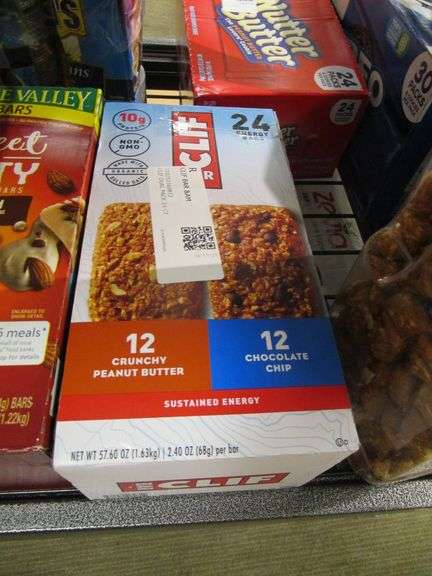
Image resolution: width=432 pixels, height=576 pixels. I want to click on jar, so pyautogui.click(x=399, y=358).